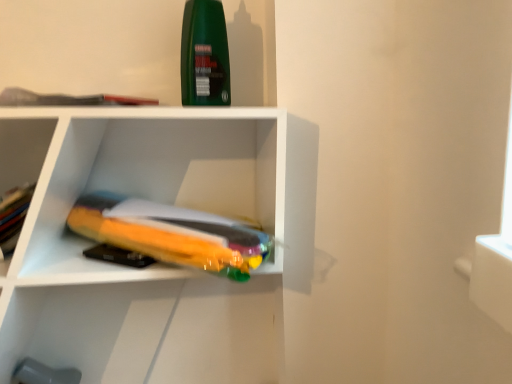
Question: Should I look upward or downward to see green matte bottle at upper center?

Choices:
 (A) down
 (B) up

Answer: (B)

Question: From a real-world perspective, is translucent orange book at center, which appears as the second book when viewed from the top, on top of translucent plastic bag at center?

Choices:
 (A) no
 (B) yes

Answer: (A)

Question: Considering the relative positions of translucent orange book at center, which appears as the second book when viewed from the top, and translucent plastic bag at center in the image provided, is translucent orange book at center, which appears as the second book when viewed from the top, to the left of translucent plastic bag at center from the viewer's perspective?

Choices:
 (A) no
 (B) yes

Answer: (A)

Question: Does translucent orange book at center, which appears as the second book when viewed from the top, appear on the right side of translucent plastic bag at center?

Choices:
 (A) no
 (B) yes

Answer: (B)

Question: Does translucent orange book at center, marked as the first book in a bottom-to-top arrangement, lie in front of translucent plastic bag at center?

Choices:
 (A) no
 (B) yes

Answer: (B)

Question: Is translucent orange book at center, which appears as the second book when viewed from the top, taller than translucent plastic bag at center?

Choices:
 (A) yes
 (B) no

Answer: (B)

Question: Can you confirm if translucent orange book at center, which appears as the second book when viewed from the top, is smaller than translucent plastic bag at center?

Choices:
 (A) yes
 (B) no

Answer: (A)

Question: Considering the relative sizes of green matte bottle at upper center and translucent orange book at center, which appears as the second book when viewed from the top, in the image provided, is green matte bottle at upper center shorter than translucent orange book at center, which appears as the second book when viewed from the top,?

Choices:
 (A) yes
 (B) no

Answer: (B)

Question: From the image's perspective, is green matte bottle at upper center above translucent orange book at center, marked as the first book in a bottom-to-top arrangement?

Choices:
 (A) yes
 (B) no

Answer: (A)

Question: From the image's perspective, would you say green matte bottle at upper center is shown under translucent orange book at center, marked as the first book in a bottom-to-top arrangement?

Choices:
 (A) yes
 (B) no

Answer: (B)

Question: Considering the relative positions of green matte bottle at upper center and translucent orange book at center, which appears as the second book when viewed from the top, in the image provided, is green matte bottle at upper center to the right of translucent orange book at center, which appears as the second book when viewed from the top, from the viewer's perspective?

Choices:
 (A) yes
 (B) no

Answer: (A)

Question: Is green matte bottle at upper center not within translucent orange book at center, which appears as the second book when viewed from the top?

Choices:
 (A) yes
 (B) no

Answer: (A)

Question: Can you confirm if green matte bottle at upper center is positioned to the left of translucent orange book at center, which appears as the second book when viewed from the top?

Choices:
 (A) no
 (B) yes

Answer: (A)

Question: Can you confirm if translucent orange book at center, marked as the first book in a bottom-to-top arrangement, is wider than matte gray book at upper left, which is the 2th book in bottom-to-top order?

Choices:
 (A) no
 (B) yes

Answer: (B)